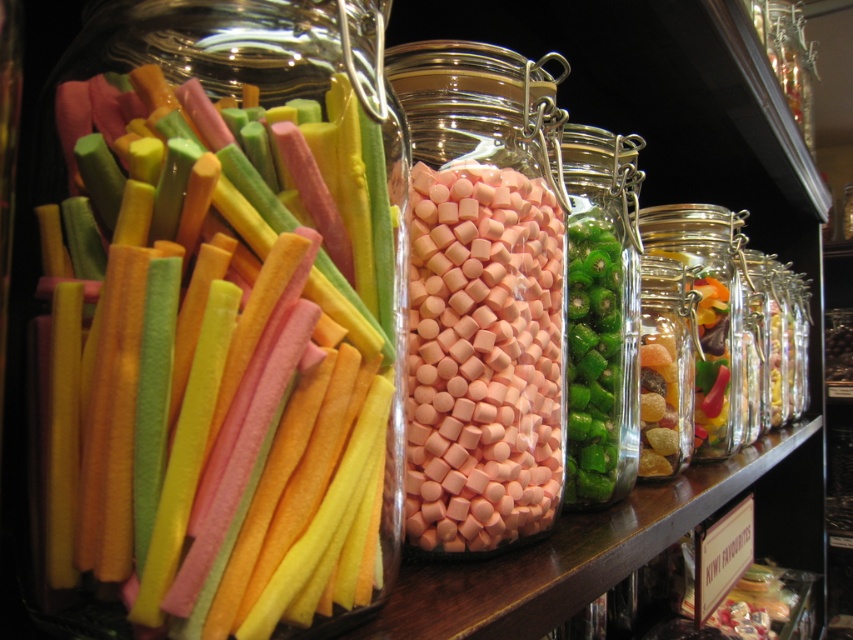
You are standing in front of the shelf of candy jars. You notice two points marked on the jars. The first point is at coordinates point [231,580] and the second point is at point [457,204]. Which point is closer to you?

Point [231,580] is in front of point [457,204], so the first point is closer to you.

You are a child trying to choose between the soft candy sticks at left and the translucent glass candy at right. You want to pick the wider one. Which jar should you choose?

The soft candy sticks at left are wider than the translucent glass candy at right, so you should choose the soft candy sticks at left.

You are a child trying to reach the candies. The soft candy sticks at left are lower than the pink matte marshmallows at center. Which jar would you need to bend down more to see?

The soft candy sticks at left are shorter than the pink matte marshmallows at center, so you would need to bend down more to see the soft candy sticks at left.